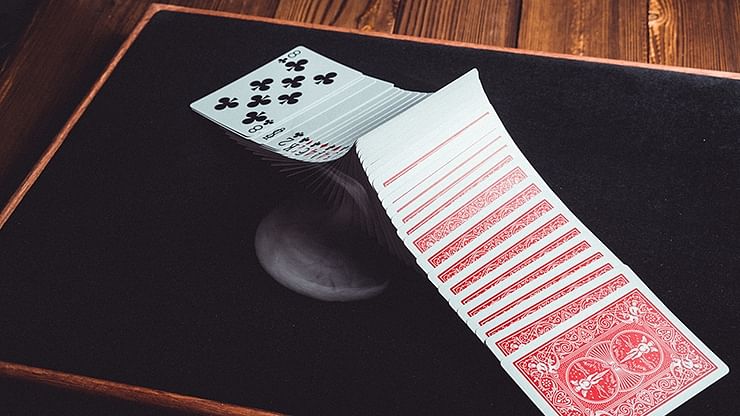
The image size is (740, 416). I want to click on tabletop board, so click(141, 219), click(653, 152).